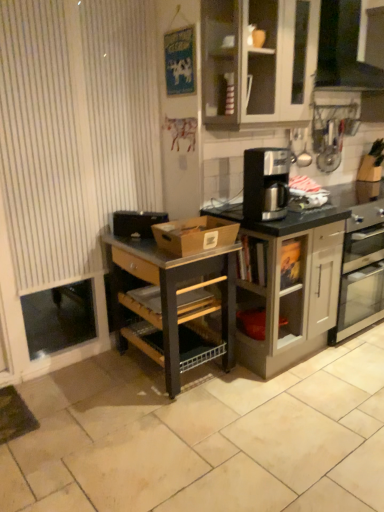
Find the location of a particular element. vacant space in front of black matte toaster at left is located at coordinates (137, 244).